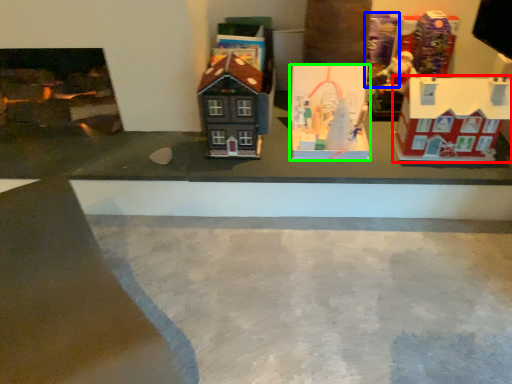
Question: Which is nearer to the toy (highlighted by a red box)? toy (highlighted by a blue box) or toy (highlighted by a green box).

Choices:
 (A) toy
 (B) toy

Answer: (B)